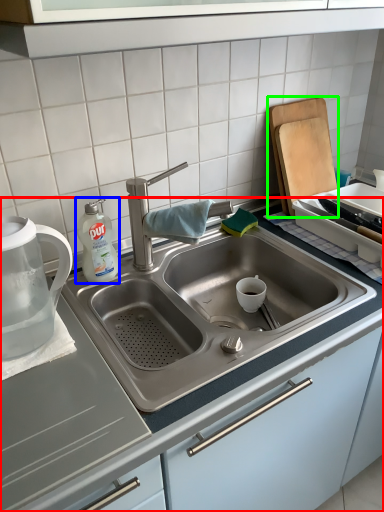
Question: Which object is positioned farthest from countertop (highlighted by a red box)? Select from cleaning product (highlighted by a blue box) and cutting board (highlighted by a green box).

Choices:
 (A) cleaning product
 (B) cutting board

Answer: (B)